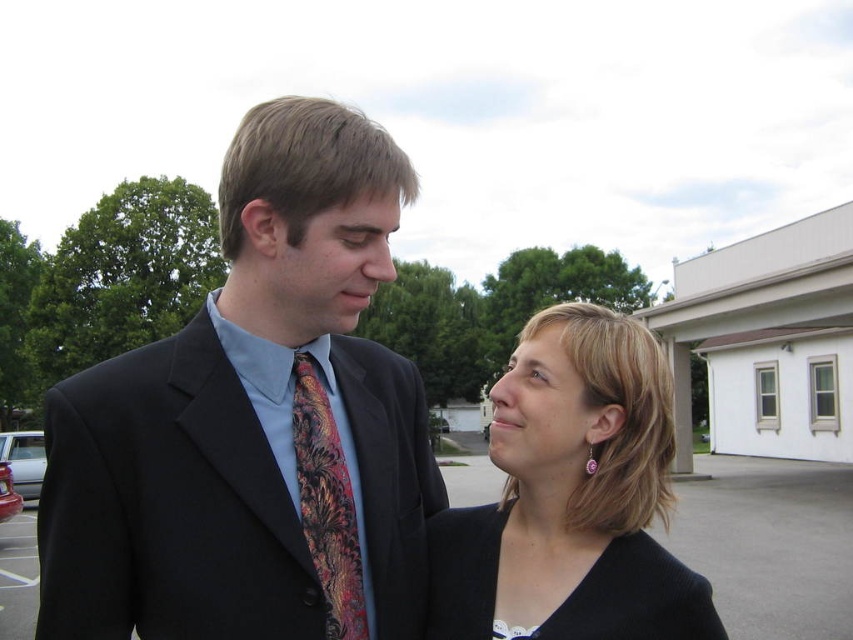
Question: Estimate the real-world distances between objects in this image. Which object is farther from the asphalt pavement at lower center?

Choices:
 (A) black fabric at center
 (B) red paisley silk tie at center
 (C) matte black suit at center

Answer: (A)

Question: Which is farther from the matte black suit at center?

Choices:
 (A) red paisley silk tie at center
 (B) black fabric at center

Answer: (B)

Question: Considering the relative positions of black fabric at center and red paisley silk tie at center in the image provided, where is black fabric at center located with respect to red paisley silk tie at center?

Choices:
 (A) above
 (B) below

Answer: (B)

Question: Is matte black suit at center behind asphalt pavement at lower center?

Choices:
 (A) no
 (B) yes

Answer: (A)

Question: Which object is closer to the camera taking this photo?

Choices:
 (A) asphalt pavement at lower center
 (B) red paisley silk tie at center
 (C) matte black suit at center
 (D) black knit dress at lower center

Answer: (C)

Question: Does matte black suit at center have a greater width compared to red paisley silk tie at center?

Choices:
 (A) yes
 (B) no

Answer: (A)